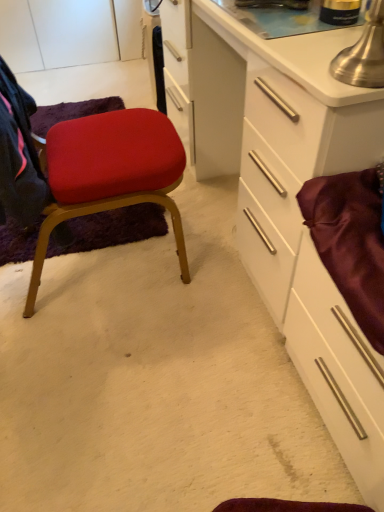
Question: Do you think white glossy cabinet at center is within satin burgundy drawer at right, or outside of it?

Choices:
 (A) inside
 (B) outside

Answer: (B)

Question: From the image's perspective, relative to satin burgundy drawer at right, is white glossy cabinet at center above or below?

Choices:
 (A) below
 (B) above

Answer: (B)

Question: Which of these objects is positioned farthest from the white glossy cabinet at center?

Choices:
 (A) matte fabric chair at left
 (B) metallic silver table lamp at upper right
 (C) satin burgundy drawer at right

Answer: (A)

Question: Which object is the farthest from the metallic silver table lamp at upper right?

Choices:
 (A) matte fabric chair at left
 (B) white glossy cabinet at center
 (C) satin burgundy drawer at right

Answer: (A)